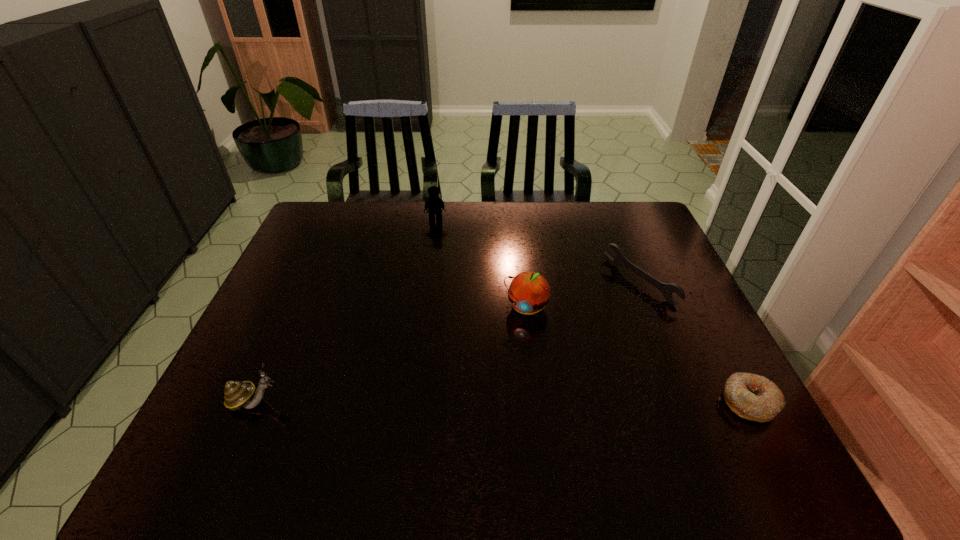
Locate an element on the screen. The height and width of the screenshot is (540, 960). free space between the snail and the Lego is located at coordinates click(x=346, y=311).

Locate an element on the screen. Image resolution: width=960 pixels, height=540 pixels. vacant area between the third object from right to left and the doughnut is located at coordinates (637, 355).

Image resolution: width=960 pixels, height=540 pixels. I want to click on free space between the fourth tallest object and the leftmost object, so click(447, 342).

Where is `vacant area between the fourth tallest object and the apple`? This screenshot has width=960, height=540. vacant area between the fourth tallest object and the apple is located at coordinates (583, 295).

This screenshot has width=960, height=540. Find the location of `free space between the snail and the Lego`. free space between the snail and the Lego is located at coordinates (346, 311).

This screenshot has width=960, height=540. In order to click on vacant space in between the shortest object and the snail in this screenshot , I will do `click(502, 402)`.

Locate an element on the screen. The width and height of the screenshot is (960, 540). vacant area that lies between the doughnut and the apple is located at coordinates (637, 355).

Locate an element on the screen. empty space that is in between the shortest object and the wrench is located at coordinates (694, 342).

The height and width of the screenshot is (540, 960). What are the coordinates of `vacant point located between the fourth object from right to left and the snail` in the screenshot? It's located at (346, 311).

Find the location of a particular element. vacant area that lies between the second shortest object and the apple is located at coordinates (583, 295).